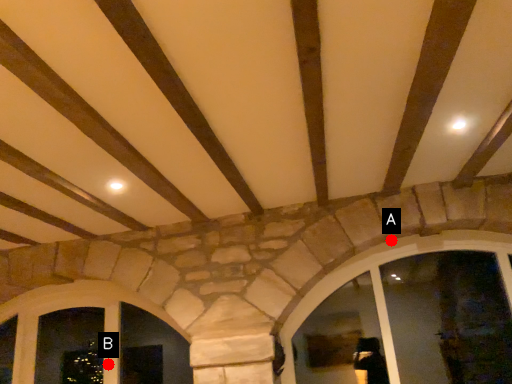
Question: Two points are circled on the image, labeled by A and B beside each circle. Among these points, which one is nearest to the camera?

Choices:
 (A) A is closer
 (B) B is closer

Answer: (A)